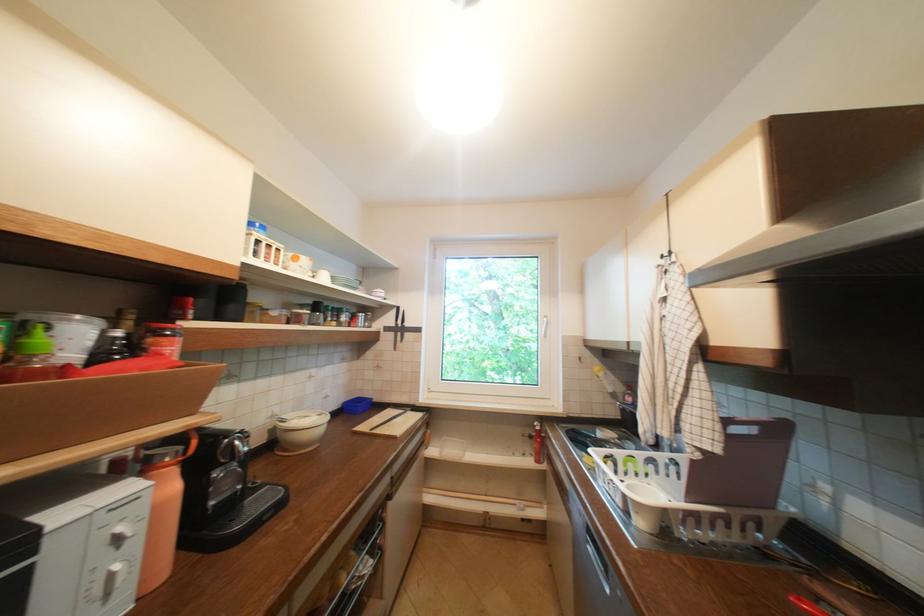
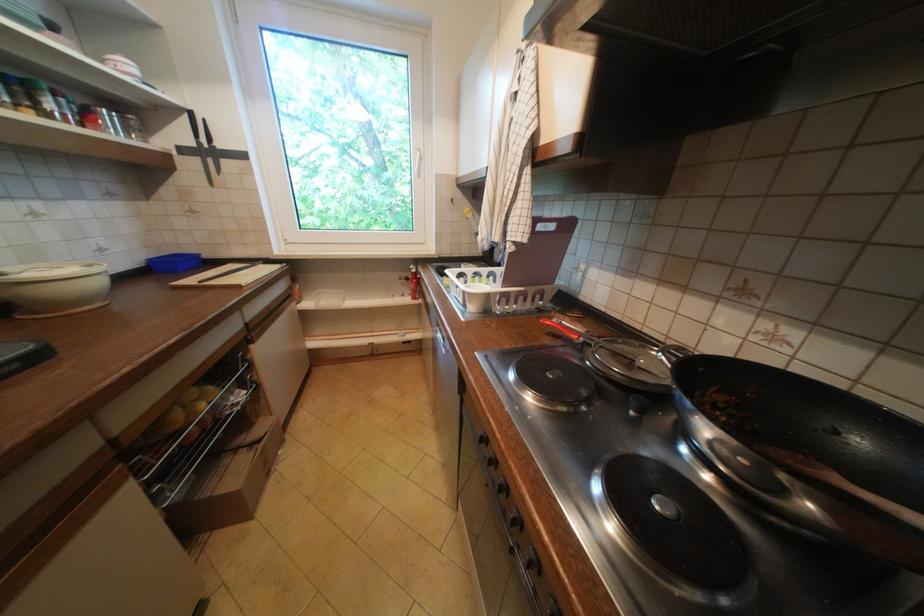
In the second image, find the point that corresponds to point 418,410 in the first image.

(270, 262)